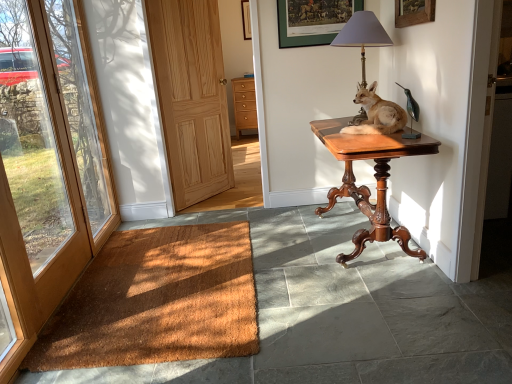
Question: Does green matte picture frame at upper center, which ranks as the second picture frame in top-to-bottom order, lie behind matte gray lampshade at upper right?

Choices:
 (A) no
 (B) yes

Answer: (B)

Question: From a real-world perspective, is green matte picture frame at upper center, the second picture frame in the back-to-front sequence, under matte gray lampshade at upper right?

Choices:
 (A) yes
 (B) no

Answer: (B)

Question: Can matte gray lampshade at upper right be found inside green matte picture frame at upper center, the second picture frame in the back-to-front sequence?

Choices:
 (A) no
 (B) yes

Answer: (A)

Question: Considering the relative positions of green matte picture frame at upper center, acting as the first picture frame starting from the bottom, and matte gray lampshade at upper right in the image provided, is green matte picture frame at upper center, acting as the first picture frame starting from the bottom, in front of matte gray lampshade at upper right?

Choices:
 (A) no
 (B) yes

Answer: (A)

Question: Is green matte picture frame at upper center, the 2th picture frame in the left-to-right sequence, positioned beyond the bounds of matte gray lampshade at upper right?

Choices:
 (A) yes
 (B) no

Answer: (A)

Question: Is green matte picture frame at upper center, which ranks as the second picture frame in top-to-bottom order, smaller than matte gray lampshade at upper right?

Choices:
 (A) yes
 (B) no

Answer: (A)

Question: Is wooden door at left, which appears as the 1th door when viewed from the front, further to camera compared to matte gray lampshade at upper right?

Choices:
 (A) no
 (B) yes

Answer: (A)

Question: Would you say wooden door at left, which is the second door in right-to-left order, is outside matte gray lampshade at upper right?

Choices:
 (A) no
 (B) yes

Answer: (B)

Question: Is wooden door at left, which is the second door in right-to-left order, wider than matte gray lampshade at upper right?

Choices:
 (A) no
 (B) yes

Answer: (A)

Question: Can you confirm if wooden door at left, which is the second door in right-to-left order, is positioned to the left of matte gray lampshade at upper right?

Choices:
 (A) no
 (B) yes

Answer: (B)

Question: From the image's perspective, is wooden door at left, which is the 1th door in left-to-right order, located beneath matte gray lampshade at upper right?

Choices:
 (A) no
 (B) yes

Answer: (B)

Question: Is wooden door at left, which is the second door in right-to-left order, oriented away from matte gray lampshade at upper right?

Choices:
 (A) yes
 (B) no

Answer: (B)

Question: Does mahogany wood table at center have a larger size compared to green matte picture frame at upper center, the first picture frame from the right?

Choices:
 (A) yes
 (B) no

Answer: (A)